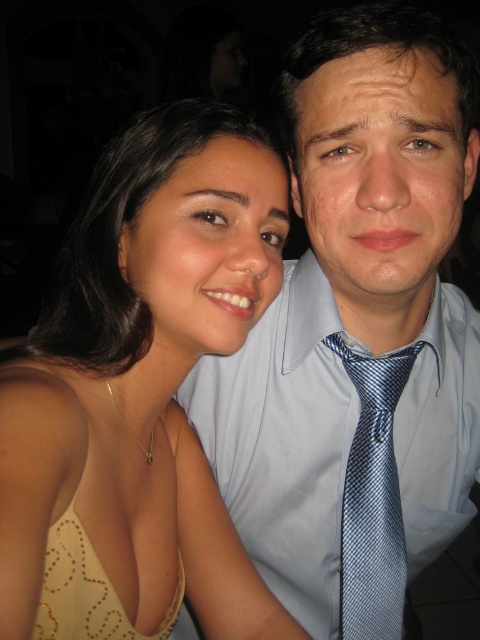
Does gold metallic dress at center have a greater height compared to blue silk tie at center?

Yes, gold metallic dress at center is taller than blue silk tie at center.

Is gold metallic dress at center positioned in front of blue silk tie at center?

Yes, gold metallic dress at center is closer to the viewer.

Locate an element on the screen. The height and width of the screenshot is (640, 480). gold metallic dress at center is located at coordinates (140, 390).

Is gold metallic dress at center in front of gold sequined dress at upper left?

Yes, gold metallic dress at center is in front of gold sequined dress at upper left.

Is gold metallic dress at center bigger than gold sequined dress at upper left?

Yes, gold metallic dress at center is bigger than gold sequined dress at upper left.

Is point (136, 417) less distant than point (44, 472)?

No, (136, 417) is further to viewer.

Identify the location of gold metallic dress at center. The height and width of the screenshot is (640, 480). (140, 390).

Between gold sequined dress at upper left and blue silk tie at center, which one has more height?

With more height is blue silk tie at center.

Between gold sequined dress at upper left and blue silk tie at center, which one appears on the right side from the viewer's perspective?

blue silk tie at center

What do you see at coordinates (81, 512) in the screenshot?
I see `gold sequined dress at upper left` at bounding box center [81, 512].

You are a GUI agent. You are given a task and a screenshot of the screen. Output one action in this format:
    pyautogui.click(x=<x>, y=<y>)
    Task: Click on the gold sequined dress at upper left
    This screenshot has height=640, width=480.
    Given the screenshot: What is the action you would take?
    pyautogui.click(x=81, y=512)